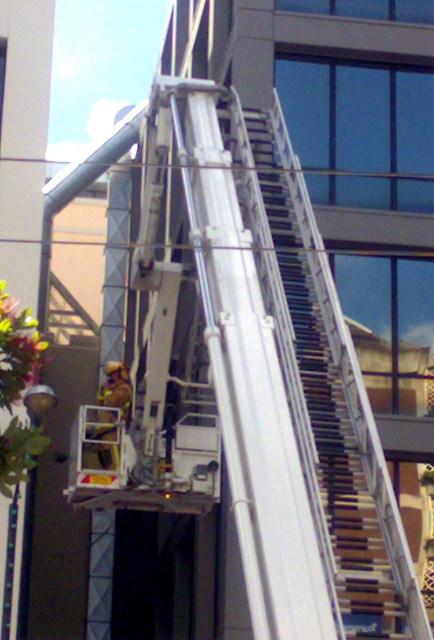
Question: Among these objects, which one is nearest to the camera?

Choices:
 (A) orange reflective safety vest at center
 (B) white wooden stairs at upper right

Answer: (B)

Question: Is the position of white wooden stairs at upper right less distant than that of orange reflective safety vest at center?

Choices:
 (A) no
 (B) yes

Answer: (B)

Question: Which of the following is the farthest from the observer?

Choices:
 (A) white wooden stairs at upper right
 (B) orange reflective safety vest at center

Answer: (B)

Question: Can you confirm if white wooden stairs at upper right is positioned below orange reflective safety vest at center?

Choices:
 (A) no
 (B) yes

Answer: (A)

Question: Among these objects, which one is nearest to the camera?

Choices:
 (A) white wooden stairs at upper right
 (B) orange reflective safety vest at center

Answer: (A)

Question: Is white wooden stairs at upper right closer to the viewer compared to orange reflective safety vest at center?

Choices:
 (A) yes
 (B) no

Answer: (A)